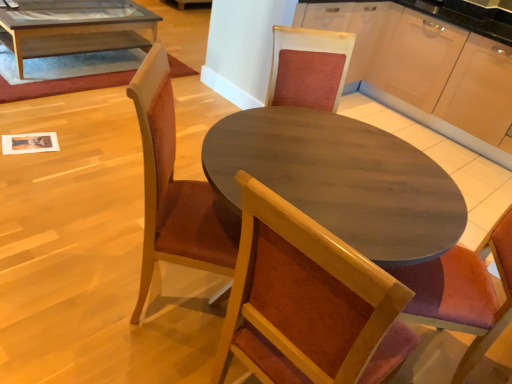
Find the location of a particular element. wooden chair at center is located at coordinates (175, 190).

Describe the element at coordinates (175, 190) in the screenshot. I see `wooden chair at center` at that location.

You are a GUI agent. You are given a task and a screenshot of the screen. Output one action in this format:
    pyautogui.click(x=<x>, y=<y>)
    Task: Click on the clear glass coffee table at upper left
    This screenshot has width=512, height=384.
    Given the screenshot: What is the action you would take?
    pyautogui.click(x=73, y=27)

This screenshot has height=384, width=512. What do you see at coordinates (73, 27) in the screenshot?
I see `clear glass coffee table at upper left` at bounding box center [73, 27].

The height and width of the screenshot is (384, 512). In order to click on wooden chair at center in this screenshot , I will do `click(175, 190)`.

Considering the relative positions of clear glass coffee table at upper left and wooden chair at center in the image provided, is clear glass coffee table at upper left to the left of wooden chair at center from the viewer's perspective?

Yes, clear glass coffee table at upper left is to the left of wooden chair at center.

Is clear glass coffee table at upper left in front of wooden chair at center?

No, clear glass coffee table at upper left is further to the viewer.

Looking at this image, which point is more distant from viewer, (109, 26) or (303, 80)?

The point (109, 26) is farther.

From the image's perspective, is clear glass coffee table at upper left on wooden chair at center?

Yes, from the image's perspective, clear glass coffee table at upper left is on top of wooden chair at center.

From a real-world perspective, which object rests below the other?

In real-world perspective, clear glass coffee table at upper left is lower.

Considering the relative sizes of clear glass coffee table at upper left and wooden chair at center in the image provided, is clear glass coffee table at upper left wider than wooden chair at center?

Correct, the width of clear glass coffee table at upper left exceeds that of wooden chair at center.

Can you confirm if clear glass coffee table at upper left is shorter than wooden chair at center?

A: Yes.

Is clear glass coffee table at upper left bigger than wooden chair at center?

Yes, clear glass coffee table at upper left is bigger than wooden chair at center.

Is clear glass coffee table at upper left inside or outside of wooden chair at center?

clear glass coffee table at upper left is located beyond the bounds of wooden chair at center.

Is clear glass coffee table at upper left far away from wooden chair at center?

Indeed, clear glass coffee table at upper left is not near wooden chair at center.

Is clear glass coffee table at upper left aimed at wooden chair at center?

Yes, clear glass coffee table at upper left is facing wooden chair at center.

From the picture: Can you tell me how much clear glass coffee table at upper left and wooden chair at center differ in facing direction?

45.8 degrees.

Find the location of a particular element. The image size is (512, 384). coffee table behind the wooden chair at center is located at coordinates (73, 27).

Does wooden chair at center appear on the right side of clear glass coffee table at upper left?

Indeed, wooden chair at center is positioned on the right side of clear glass coffee table at upper left.

Considering the positions of objects wooden chair at center and clear glass coffee table at upper left in the image provided, who is in front, wooden chair at center or clear glass coffee table at upper left?

Positioned in front is wooden chair at center.

Which point is more forward, (170,184) or (156,24)?

Positioned in front is point (170,184).

From the image's perspective, which object appears higher, wooden chair at center or clear glass coffee table at upper left?

clear glass coffee table at upper left is shown above in the image.

From a real-world perspective, is wooden chair at center over clear glass coffee table at upper left?

Yes.

Is wooden chair at center wider or thinner than clear glass coffee table at upper left?

Clearly, wooden chair at center has less width compared to clear glass coffee table at upper left.

Considering the sizes of objects wooden chair at center and clear glass coffee table at upper left in the image provided, who is shorter, wooden chair at center or clear glass coffee table at upper left?

Standing shorter between the two is clear glass coffee table at upper left.

Is wooden chair at center smaller than clear glass coffee table at upper left?

Yes.

Would you say wooden chair at center is outside clear glass coffee table at upper left?

Yes, wooden chair at center is not within clear glass coffee table at upper left.

Are wooden chair at center and clear glass coffee table at upper left beside each other?

No, wooden chair at center is not touching clear glass coffee table at upper left.

Is wooden chair at center turned away from clear glass coffee table at upper left?

No, clear glass coffee table at upper left is not at the back of wooden chair at center.

How many degrees apart are the facing directions of wooden chair at center and clear glass coffee table at upper left?

There is a 45.8-degree angle between the facing directions of wooden chair at center and clear glass coffee table at upper left.

Find the location of a particular element. chair above the clear glass coffee table at upper left (from a real-world perspective) is located at coordinates [175, 190].

The width and height of the screenshot is (512, 384). I want to click on chair above the clear glass coffee table at upper left (from a real-world perspective), so click(x=175, y=190).

You are a GUI agent. You are given a task and a screenshot of the screen. Output one action in this format:
    pyautogui.click(x=<x>, y=<y>)
    Task: Click on the chair on the right of clear glass coffee table at upper left
    This screenshot has width=512, height=384.
    Given the screenshot: What is the action you would take?
    pyautogui.click(x=175, y=190)